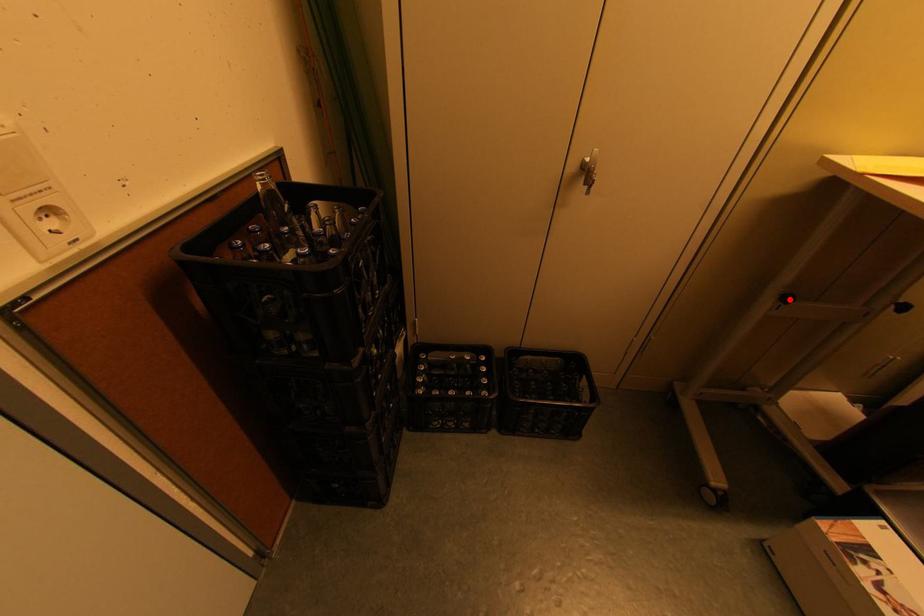
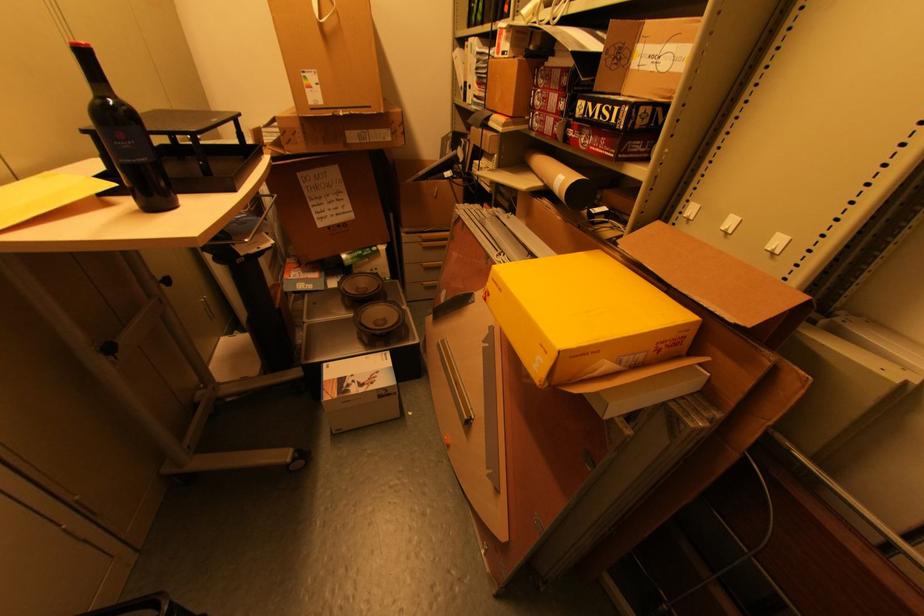
Where in the second image is the point corresponding to the highlighted location from the first image?

(114, 349)